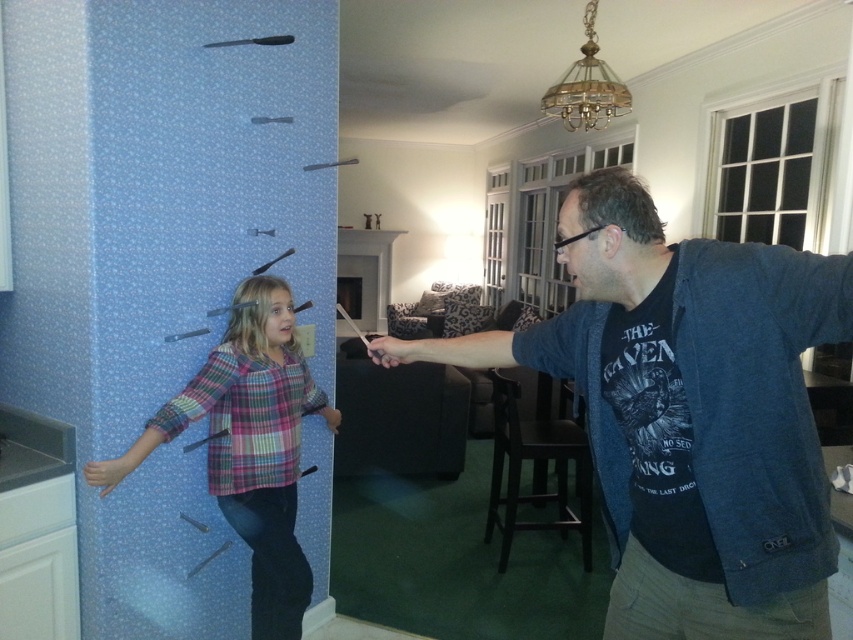
You are a photographer standing 1.5 meters away from the camera. You want to take a photo of the dark blue textured jacket at center right. Can you reach the jacket without moving the camera?

The dark blue textured jacket at center right and camera are 1.09 meters apart. Since you are standing 1.5 meters away from the camera, you are 2.59 meters away from the jacket. Therefore, you cannot reach the jacket without moving the camera.

You are standing in the room and see the point at coordinates (688, 413). What object is this point located on?

The point at coordinates (688, 413) is located on the dark blue textured jacket at center right.

You are a tailor who needs to adjust the length of two garments in the image. The dark blue textured jacket at center right and the plaid fabric shirt at center. Which garment should you shorten to match the other?

The dark blue textured jacket at center right is shorter than the plaid fabric shirt at center. To match their lengths, you should shorten the plaid fabric shirt at center.